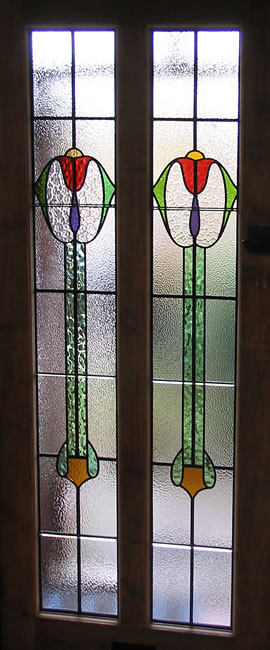
You are a GUI agent. You are given a task and a screenshot of the screen. Output one action in this format:
    pyautogui.click(x=<x>, y=<y>)
    Task: Click on the frame
    This screenshot has width=270, height=650.
    Given the screenshot: What is the action you would take?
    pyautogui.click(x=251, y=444)